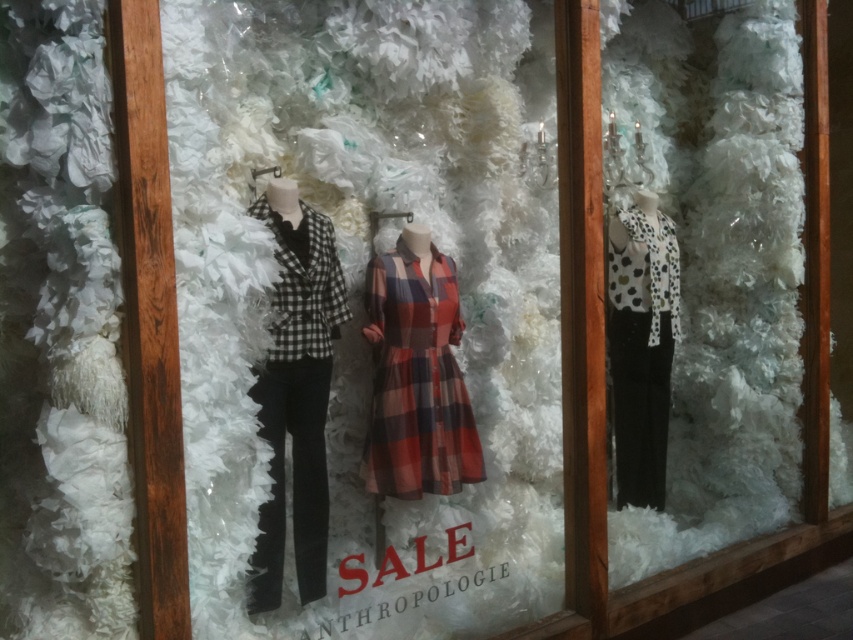
Question: Considering the relative positions of plaid cotton dress at center and white dotted fabric top at right in the image provided, where is plaid cotton dress at center located with respect to white dotted fabric top at right?

Choices:
 (A) left
 (B) right

Answer: (A)

Question: Which point is farther from the camera taking this photo?

Choices:
 (A) (387, 380)
 (B) (653, 236)

Answer: (B)

Question: Which of the following is the closest to the observer?

Choices:
 (A) white dotted fabric top at right
 (B) black checkered blazer at left

Answer: (B)

Question: Is black checkered blazer at left to the right of white dotted fabric top at right from the viewer's perspective?

Choices:
 (A) no
 (B) yes

Answer: (A)

Question: Can you confirm if black checkered blazer at left is bigger than plaid cotton dress at center?

Choices:
 (A) no
 (B) yes

Answer: (B)

Question: Which object appears farthest from the camera in this image?

Choices:
 (A) black checkered blazer at left
 (B) white dotted fabric top at right
 (C) plaid cotton dress at center

Answer: (B)